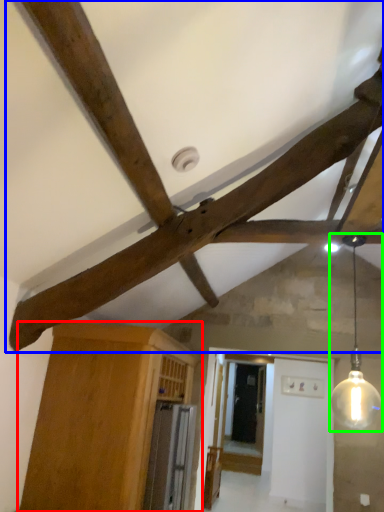
Question: Which is nearer to the cabinetry (highlighted by a red box)? fan (highlighted by a blue box) or light fixture (highlighted by a green box).

Choices:
 (A) fan
 (B) light fixture

Answer: (A)